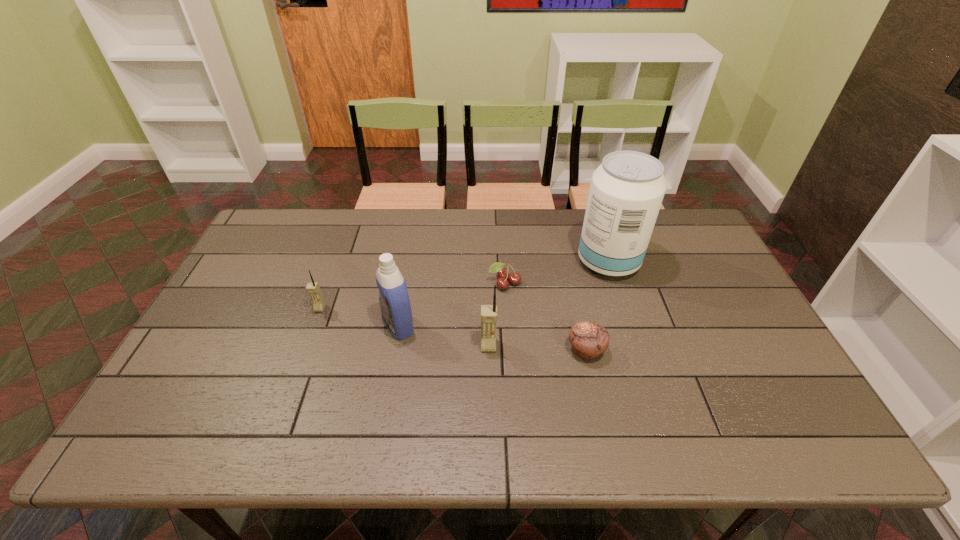
Identify the location of unoccupied area between the fifth object from right to left and the alcohol. pyautogui.click(x=503, y=293).

Locate which object is the fourth closest to the tallest object. Please provide its 2D coordinates. Your answer should be formatted as a tuple, i.e. [(x, y)], where the tuple contains the x and y coordinates of a point satisfying the conditions above.

[(394, 301)]

Locate an element on the screen. object that stands as the second closest to the tallest object is located at coordinates (589, 339).

Find the location of a particular element. The height and width of the screenshot is (540, 960). vacant point that satisfies the following two spatial constraints: 1. on the front of the detergent, where the keypad is located; 2. on the right side of the shorter cellular telephone is located at coordinates pos(314,325).

Find the location of a particular element. This screenshot has width=960, height=540. free spot that satisfies the following two spatial constraints: 1. on the front of the right cellular telephone, where the keypad is located; 2. on the left side of the muffin is located at coordinates (489, 350).

The height and width of the screenshot is (540, 960). In order to click on vacant space that satisfies the following two spatial constraints: 1. on the front of the right cellular telephone, where the keypad is located; 2. on the left side of the muffin in this screenshot , I will do `click(489, 350)`.

Identify the location of free location that satisfies the following two spatial constraints: 1. on the front of the muffin, where the keypad is located; 2. on the right side of the right cellular telephone. (489, 350).